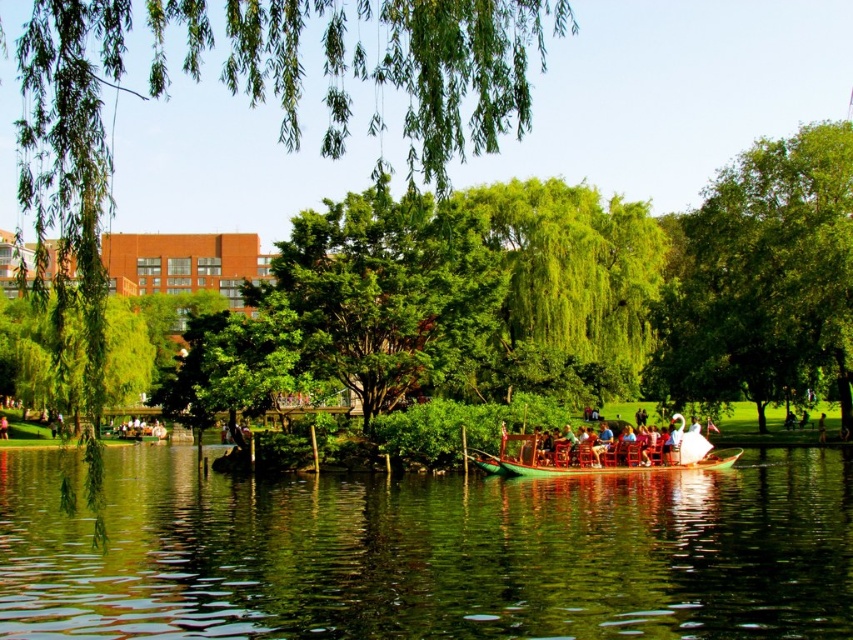
Is green polished wood boat at center bigger than green wooden boat at center?

Indeed, green polished wood boat at center has a larger size compared to green wooden boat at center.

Measure the distance between green polished wood boat at center and camera.

The distance of green polished wood boat at center from camera is 39.28 meters.

Locate an element on the screen. green polished wood boat at center is located at coordinates (430, 552).

Which is below, green polished wood boat at center or green leafy tree at upper right?

Positioned lower is green polished wood boat at center.

Locate an element on the screen. The height and width of the screenshot is (640, 853). green polished wood boat at center is located at coordinates (430, 552).

The width and height of the screenshot is (853, 640). I want to click on green polished wood boat at center, so click(430, 552).

Does green leafy tree at upper right have a lesser height compared to green wooden boat at center?

In fact, green leafy tree at upper right may be taller than green wooden boat at center.

Can you confirm if green leafy tree at upper right is positioned below green wooden boat at center?

No, green leafy tree at upper right is not below green wooden boat at center.

Is point (837, 316) more distant than point (670, 435)?

Yes, it is.

You are a GUI agent. You are given a task and a screenshot of the screen. Output one action in this format:
    pyautogui.click(x=<x>, y=<y>)
    Task: Click on the green leafy tree at upper right
    
    Given the screenshot: What is the action you would take?
    coord(763,280)